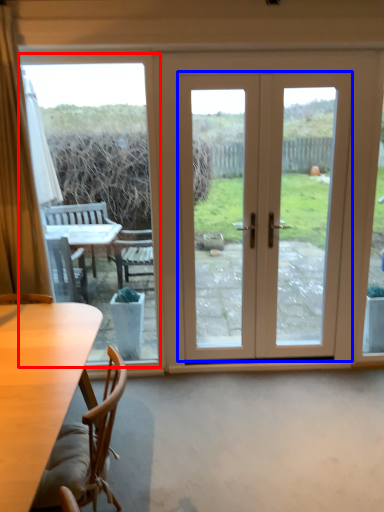
Question: Which object appears closest to the camera in this image, window screen (highlighted by a red box) or door (highlighted by a blue box)?

Choices:
 (A) window screen
 (B) door

Answer: (A)